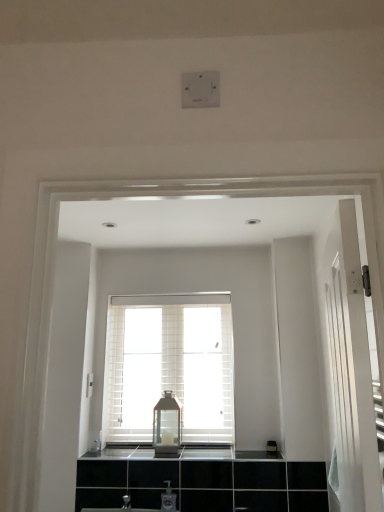
Where is `vacant space in matte glass lantern at center (from a real-world perspective)`? vacant space in matte glass lantern at center (from a real-world perspective) is located at coordinates (158, 448).